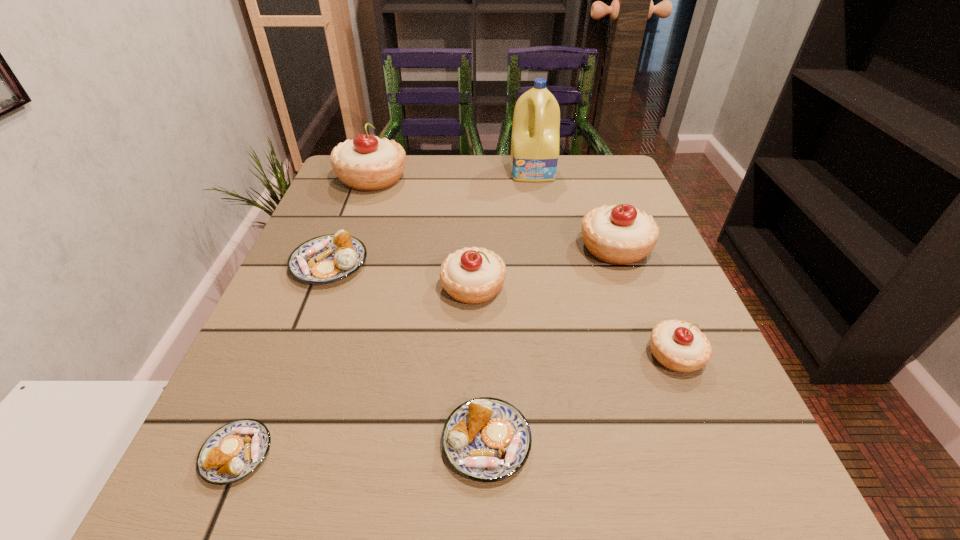
I want to click on free location at the left edge, so click(x=336, y=213).

In the image, there is a desktop. Identify the location of vacant space at the right edge. (601, 280).

This screenshot has width=960, height=540. What are the coordinates of `free space at the far right corner` in the screenshot? It's located at (605, 158).

Identify the location of blank space at the near right corner of the desktop. (737, 470).

You are a GUI agent. You are given a task and a screenshot of the screen. Output one action in this format:
    pyautogui.click(x=<x>, y=<y>)
    Task: Click on the unoccupied position between the fifth tallest object and the rightmost brown pastry
    The image size is (960, 540).
    Given the screenshot: What is the action you would take?
    pyautogui.click(x=581, y=399)

Locate an element on the screen. The width and height of the screenshot is (960, 540). vacant area that lies between the second biggest brown pastry and the shortest object is located at coordinates (362, 448).

Locate an element on the screen. vacant region between the rightmost brown pastry and the fourth shortest pastry is located at coordinates (581, 399).

Where is `free space between the rightmost brown pastry and the nearest beige pastry`? This screenshot has height=540, width=960. free space between the rightmost brown pastry and the nearest beige pastry is located at coordinates (581, 399).

Where is `vacant space that's between the second shortest pastry and the leftmost beige pastry`? Image resolution: width=960 pixels, height=540 pixels. vacant space that's between the second shortest pastry and the leftmost beige pastry is located at coordinates point(429,310).

Where is `unoccupied area between the shortest pastry and the seventh tallest object`? The width and height of the screenshot is (960, 540). unoccupied area between the shortest pastry and the seventh tallest object is located at coordinates (362, 448).